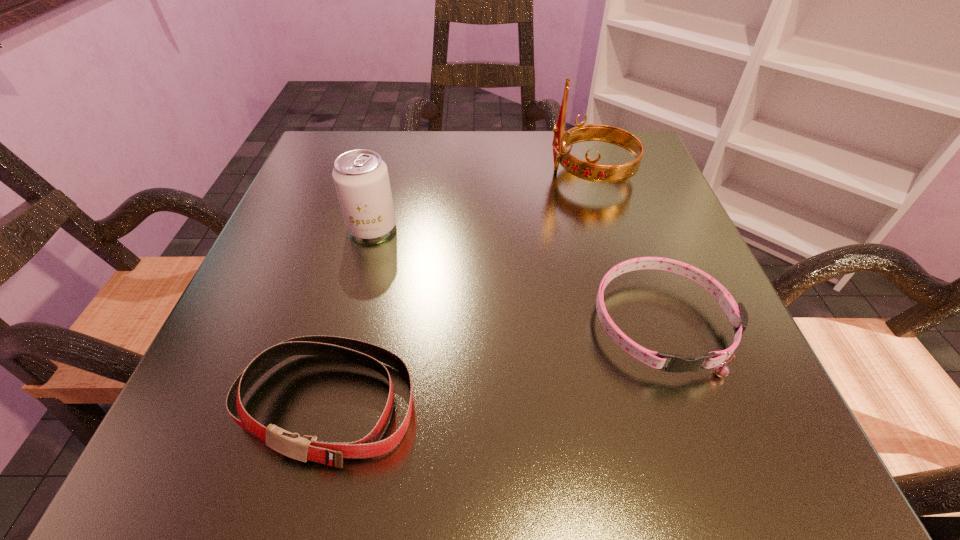
Where is `vacant region located 0.340m on the front-facing side of the tallest object`? The image size is (960, 540). vacant region located 0.340m on the front-facing side of the tallest object is located at coordinates (384, 173).

The width and height of the screenshot is (960, 540). I want to click on free spot located 0.170m on the right of the second farthest object, so click(491, 227).

The image size is (960, 540). What are the coordinates of `free space located 0.400m on the right of the taller dog collar` in the screenshot? It's located at (733, 404).

I want to click on vacant space located with the buckle on the right dog collar, so click(x=703, y=441).

Find the location of a particular element. object that is at the far edge is located at coordinates (590, 171).

Where is `object that is at the near edge`? object that is at the near edge is located at coordinates (304, 448).

At what (x,y) coordinates should I click in order to perform the action: click on soda can situated at the left edge. Please return your answer as a coordinate pair (x, y). Looking at the image, I should click on (361, 179).

Where is `dog collar situated at the left edge`? The height and width of the screenshot is (540, 960). dog collar situated at the left edge is located at coordinates (304, 448).

Locate an element on the screen. This screenshot has height=540, width=960. tiara present at the right edge is located at coordinates (590, 171).

This screenshot has width=960, height=540. In order to click on dog collar at the right edge in this screenshot , I will do `click(736, 313)`.